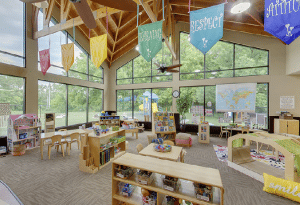
This screenshot has height=205, width=300. In order to click on clock in this screenshot , I will do `click(175, 94)`.